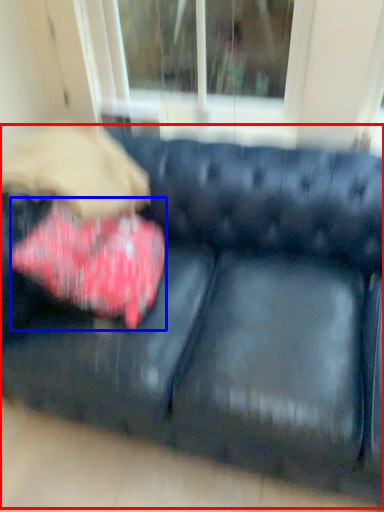
Question: Which of the following is the closest to the observer, studio couch (highlighted by a red box) or throw pillow (highlighted by a blue box)?

Choices:
 (A) studio couch
 (B) throw pillow

Answer: (A)